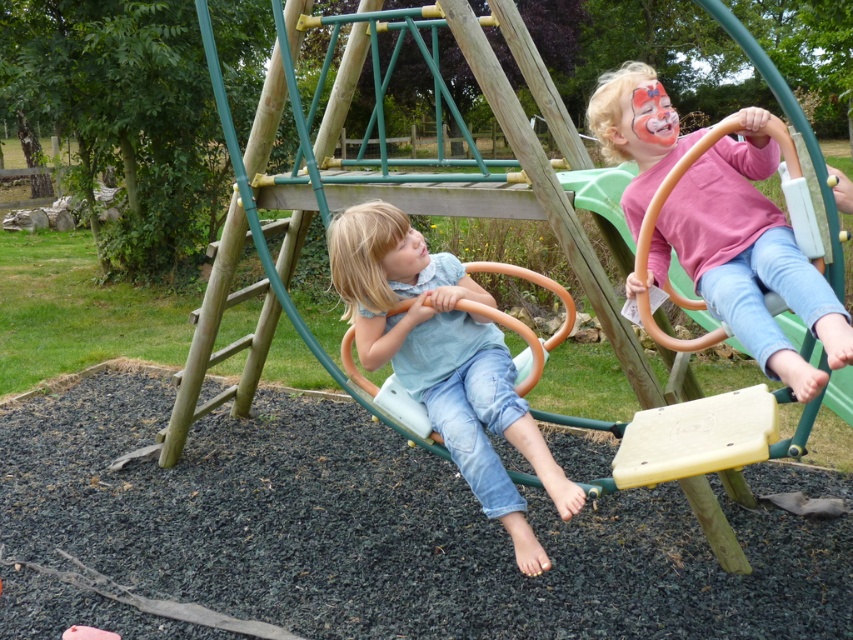
Question: Does pink matte shirt at upper right appear over light blue denim jeans at center?

Choices:
 (A) yes
 (B) no

Answer: (A)

Question: Is pink matte shirt at upper right thinner than matte pink face paint at upper right?

Choices:
 (A) yes
 (B) no

Answer: (B)

Question: Which object is farther from the camera taking this photo?

Choices:
 (A) smooth skin face at center
 (B) light blue denim jeans at center
 (C) pink matte shirt at upper right

Answer: (A)

Question: Which object is closer to the camera taking this photo?

Choices:
 (A) light blue denim jeans at center
 (B) smooth skin face at center
 (C) matte pink face paint at upper right

Answer: (A)

Question: Estimate the real-world distances between objects in this image. Which object is farther from the light blue denim jeans at center?

Choices:
 (A) pink matte shirt at upper right
 (B) matte pink face paint at upper right

Answer: (B)

Question: Does pink matte shirt at upper right appear on the right side of light blue denim jeans at center?

Choices:
 (A) no
 (B) yes

Answer: (B)